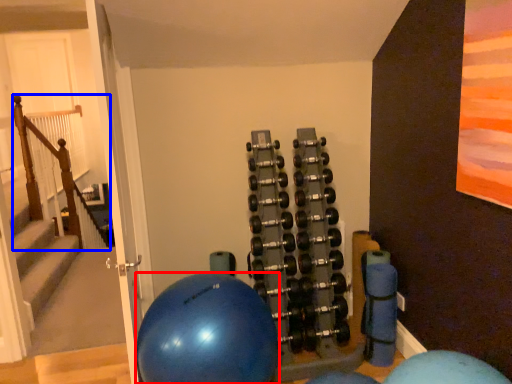
Question: Which object appears closest to the camera in this image, ball (highlighted by a red box) or rail (highlighted by a blue box)?

Choices:
 (A) ball
 (B) rail

Answer: (A)